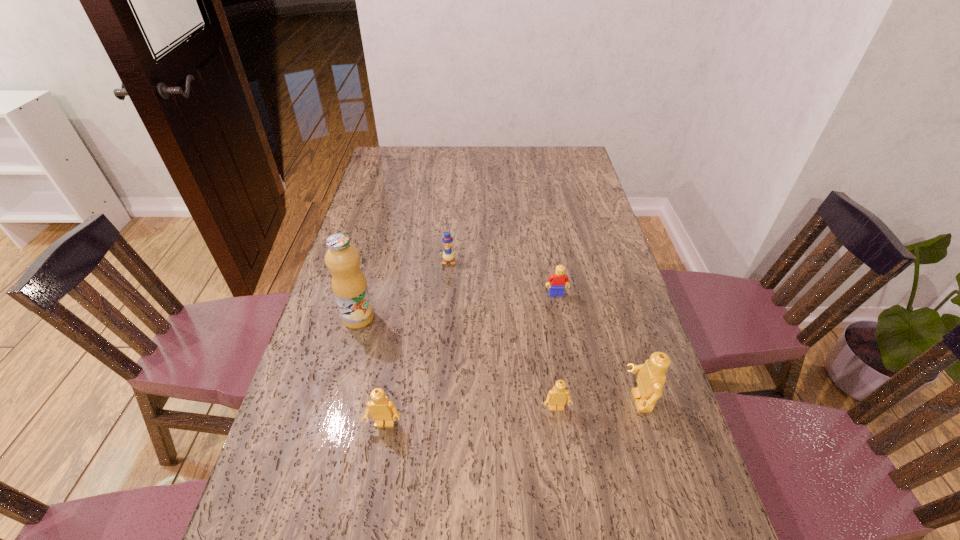
Identify which object is located as the third nearest to the farthest object. Please provide its 2D coordinates. Your answer should be formatted as a tuple, i.e. [(x, y)], where the tuple contains the x and y coordinates of a point satisfying the conditions above.

[(382, 409)]

Locate which object ranks in proximity to the duckling. Please provide its 2D coordinates. Your answer should be formatted as a tuple, i.e. [(x, y)], where the tuple contains the x and y coordinates of a point satisfying the conditions above.

[(349, 284)]

Identify which Lego is the nearest to the duckling. Please provide its 2D coordinates. Your answer should be formatted as a tuple, i.e. [(x, y)], where the tuple contains the x and y coordinates of a point satisfying the conditions above.

[(558, 279)]

I want to click on Lego that is the nearest to the leftmost Lego, so click(557, 396).

The height and width of the screenshot is (540, 960). What are the coordinates of `vacant space that satisfies the following two spatial constraints: 1. on the face of the rightmost object; 2. on the face of the fifth object from right to left` in the screenshot? It's located at (645, 424).

Where is `free point that satisfies the following two spatial constraints: 1. on the face of the farthest Lego; 2. on the front label of the leftmost object`? free point that satisfies the following two spatial constraints: 1. on the face of the farthest Lego; 2. on the front label of the leftmost object is located at coordinates (561, 318).